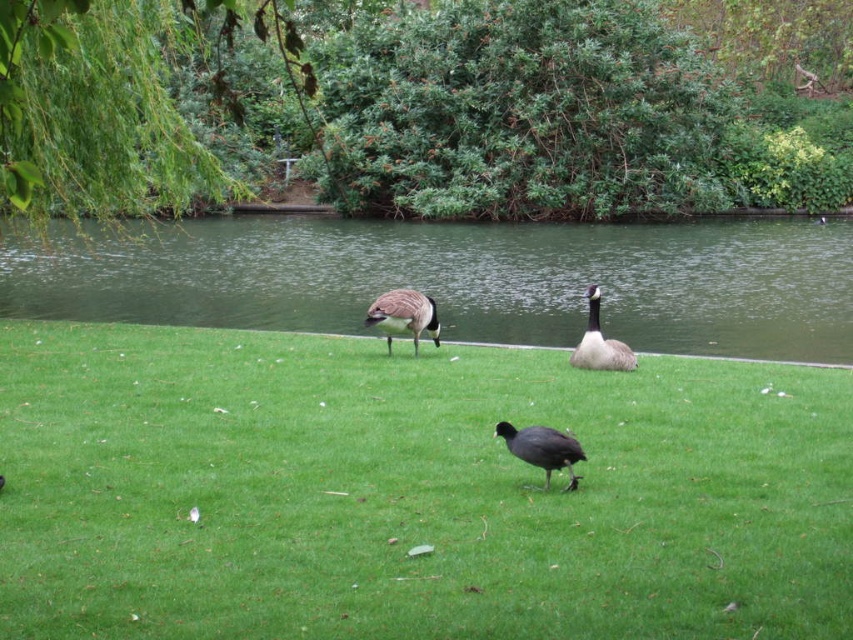
You are standing at the origin point in the image and want to walk towards the two points marked. Which point, point (401, 253) or point (596, 339), will you encounter first?

You will encounter point (596, 339) first because it is closer to you than point (401, 253), which is further away.

You are standing at the point labeled point [120,300] and want to reach the water edge. The two Canada geese are 25.31 meters apart. Can you walk straight to the water without passing between the two geese?

The two Canada geese are 25.31 meters apart, so walking straight to the water from point [120,300] would require passing between them if they are positioned along your path. However, without knowing their exact positions relative to your path, it is impossible to determine if you would pass between them. The distance between the geese alone does not provide sufficient information about their alignment with your path.

You are a nature photographer observing the scene. You need to capture a photo that includes both the black matte bird at center and the brown speckled feathers at center. Based on their positions, which bird is located to the right of the other?

The black matte bird at center is positioned on the right side of brown speckled feathers at center.